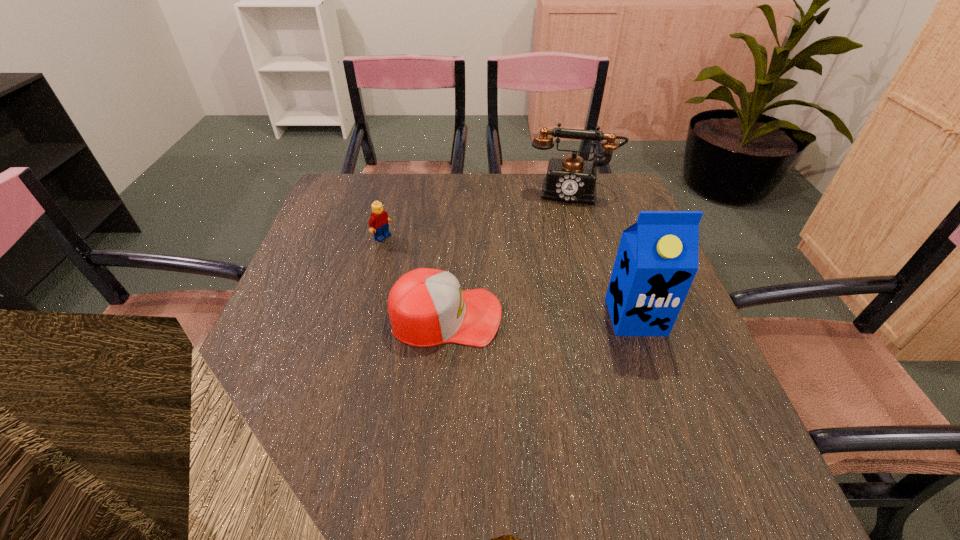
Find the location of a particular element. The image size is (960, 540). free spot at the left edge of the desktop is located at coordinates (357, 274).

What are the coordinates of `vacant region at the right edge of the desktop` in the screenshot? It's located at (636, 361).

This screenshot has height=540, width=960. I want to click on free space at the far left corner, so click(x=353, y=178).

Where is `blank space at the near left corner`? blank space at the near left corner is located at coordinates (300, 411).

Image resolution: width=960 pixels, height=540 pixels. What are the coordinates of `free spot between the second object from left to right and the carton` in the screenshot? It's located at (540, 316).

At what (x,y) coordinates should I click in order to perform the action: click on free point between the telephone and the baseball cap. Please return your answer as a coordinate pair (x, y). Looking at the image, I should click on (509, 254).

Locate an element on the screen. This screenshot has height=540, width=960. unoccupied position between the second tallest object and the Lego is located at coordinates (477, 214).

This screenshot has height=540, width=960. Find the location of `vacant space that's between the second tallest object and the baseball cap`. vacant space that's between the second tallest object and the baseball cap is located at coordinates (509, 254).

This screenshot has width=960, height=540. I want to click on vacant space in between the farthest object and the third object from right to left, so click(x=509, y=254).

Find the location of a particular element. free space between the leftmost object and the telephone is located at coordinates (477, 214).